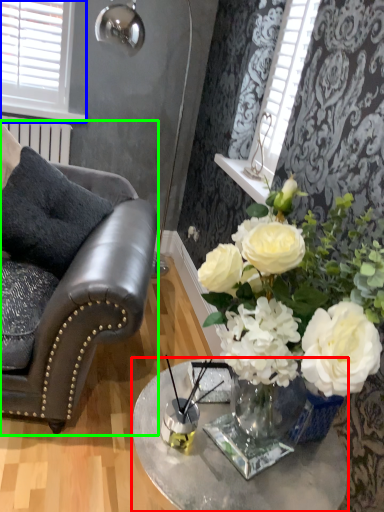
Question: Considering the real-world distances, which object is farthest from table (highlighted by a red box)? window (highlighted by a blue box) or chair (highlighted by a green box)?

Choices:
 (A) window
 (B) chair

Answer: (A)